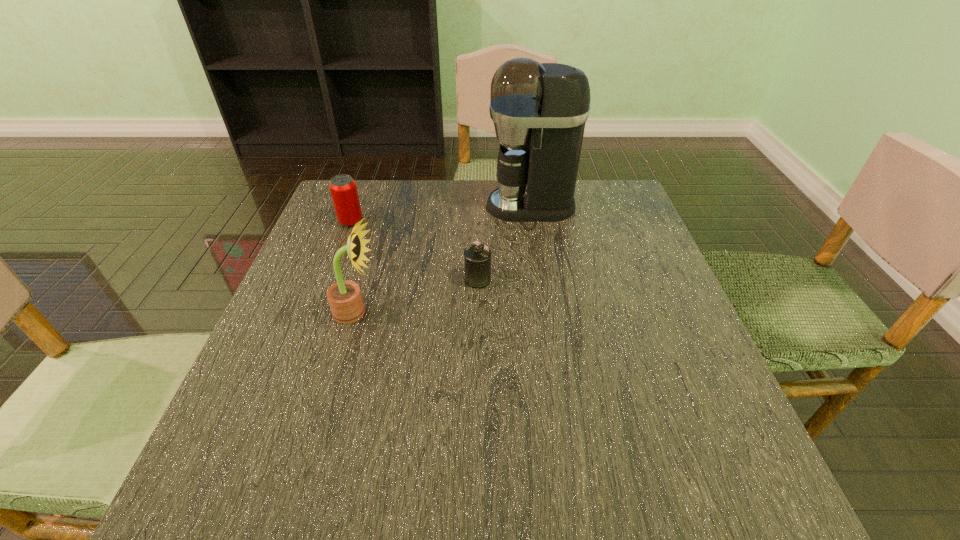
Identify the location of coffee maker. The height and width of the screenshot is (540, 960). (539, 110).

The width and height of the screenshot is (960, 540). I want to click on the second tallest object, so click(345, 300).

Where is `sunflower`? The image size is (960, 540). sunflower is located at coordinates (345, 300).

Find the location of `the left can`. the left can is located at coordinates (343, 189).

What are the coordinates of `the leftmost object` in the screenshot? It's located at (343, 189).

You are a GUI agent. You are given a task and a screenshot of the screen. Output one action in this format:
    pyautogui.click(x=<x>, y=<y>)
    Task: Click on the nearer can
    Image resolution: width=960 pixels, height=540 pixels.
    Given the screenshot: What is the action you would take?
    pyautogui.click(x=477, y=256)

You are a GUI agent. You are given a task and a screenshot of the screen. Output one action in this format:
    pyautogui.click(x=<x>, y=<y>)
    Task: Click on the third farthest object
    
    Given the screenshot: What is the action you would take?
    pyautogui.click(x=477, y=256)

Where is `free space located 0.190m place cup under the spout of the coffee maker`? free space located 0.190m place cup under the spout of the coffee maker is located at coordinates (416, 206).

At what (x,y) coordinates should I click in order to perform the action: click on free space located 0.230m place cup under the spout of the coffee maker. Please return your answer as a coordinate pair (x, y). Looking at the image, I should click on (401, 206).

You are a GUI agent. You are given a task and a screenshot of the screen. Output one action in this format:
    pyautogui.click(x=<x>, y=<y>)
    Task: Click on the vacant space located 0.310m place cup under the spout of the coffee maker
    This screenshot has height=540, width=960.
    Given the screenshot: What is the action you would take?
    [x=372, y=206]